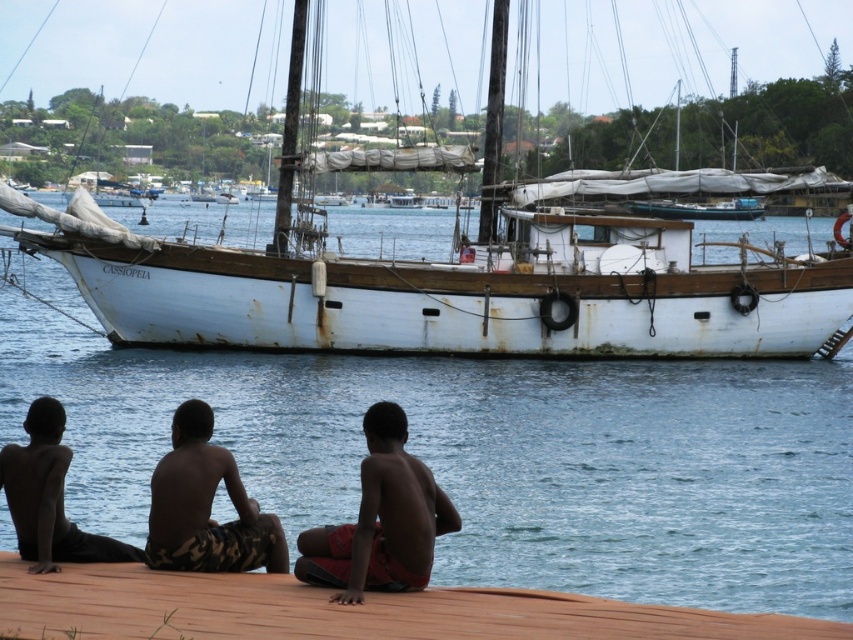
Question: Estimate the real-world distances between objects in this image. Which object is closer to the rusty wooden sailboat at center?

Choices:
 (A) dark skin/soft skin child at lower left
 (B) brown wooden dock at lower center
 (C) red fabric shorts at lower center

Answer: (C)

Question: Which point is farther to the camera?

Choices:
 (A) (363, 500)
 (B) (212, 534)

Answer: (B)

Question: Where is rusty wooden sailboat at center located in relation to camo shorts at lower center in the image?

Choices:
 (A) right
 (B) left

Answer: (B)

Question: Does rusty wooden sailboat at center have a larger size compared to red fabric shorts at lower center?

Choices:
 (A) no
 (B) yes

Answer: (B)

Question: Which point is closer to the camera taking this photo?

Choices:
 (A) (744, 266)
 (B) (48, 586)

Answer: (B)

Question: Can you confirm if red fabric shorts at lower center is positioned above camo shorts at lower center?

Choices:
 (A) yes
 (B) no

Answer: (B)